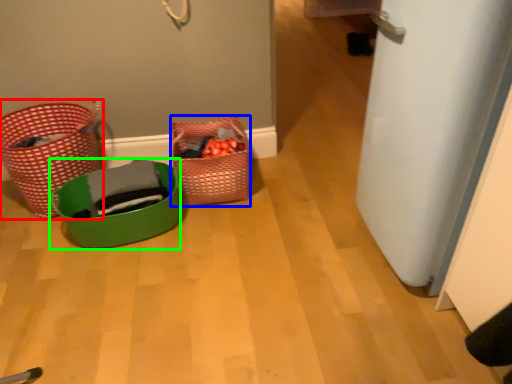
Question: Considering the real-world distances, which object is closest to basket (highlighted by a red box)? basket (highlighted by a blue box) or basket (highlighted by a green box).

Choices:
 (A) basket
 (B) basket

Answer: (B)